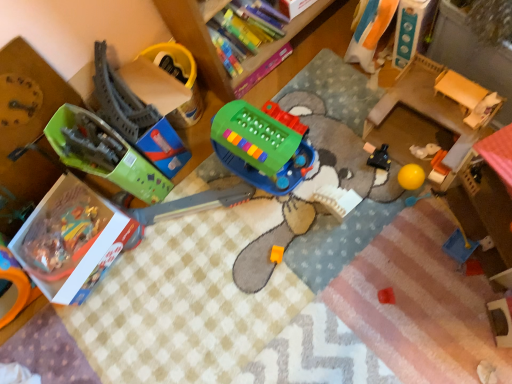
Where is `vacant space to the right of white cardboard box at left, which is counted as the second box, starting from the top`? Image resolution: width=512 pixels, height=384 pixels. vacant space to the right of white cardboard box at left, which is counted as the second box, starting from the top is located at coordinates (183, 233).